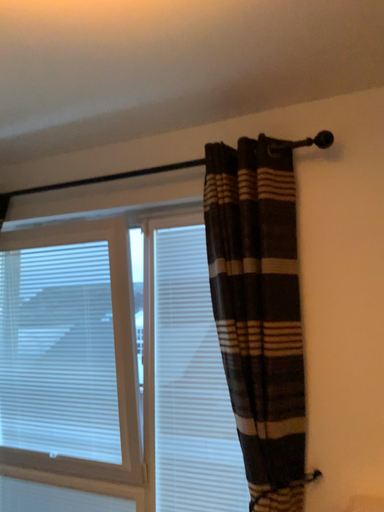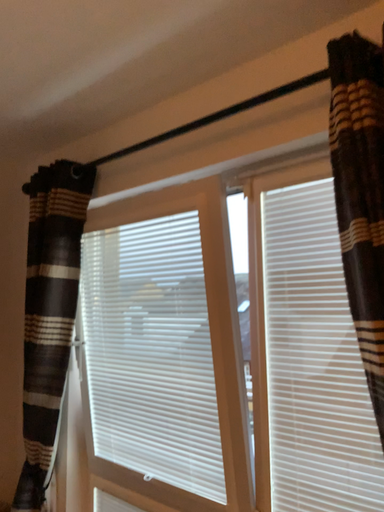
Question: How did the camera likely rotate when shooting the video?

Choices:
 (A) rotated right
 (B) rotated left

Answer: (B)